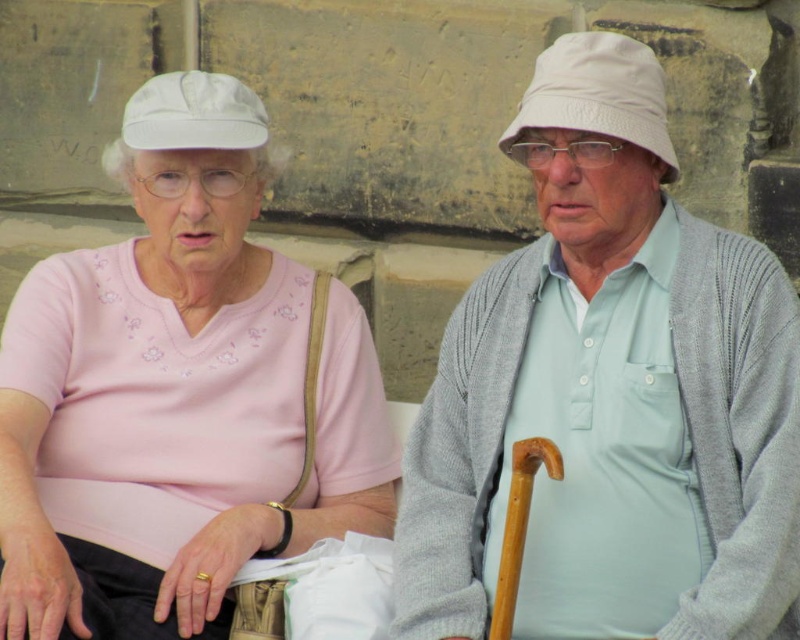
The height and width of the screenshot is (640, 800). What are the coordinates of `white fabric baseball hat at upper right` in the screenshot? It's located at (598, 93).

Is white fabric baseball hat at upper right further to camera compared to white fabric baseball cap at upper left?

No.

Between point (620, 67) and point (193, 136), which one is positioned behind?

The point (193, 136) is more distant.

Image resolution: width=800 pixels, height=640 pixels. I want to click on white fabric baseball hat at upper right, so click(x=598, y=93).

Does light gray knit sweater at center lie behind matte pink shirt at center?

No, light gray knit sweater at center is closer to the viewer.

Which is above, light gray knit sweater at center or matte pink shirt at center?

light gray knit sweater at center is above.

Consider the image. Who is more forward, (x=522, y=376) or (x=393, y=508)?

Point (x=522, y=376)

Locate an element on the screen. light gray knit sweater at center is located at coordinates (610, 394).

How much distance is there between light gray knit sweater at center and white fabric baseball cap at upper left?

3.35 feet

Is point (528, 168) farther from camera compared to point (158, 132)?

No, it is not.

This screenshot has width=800, height=640. Identify the location of light gray knit sweater at center. (610, 394).